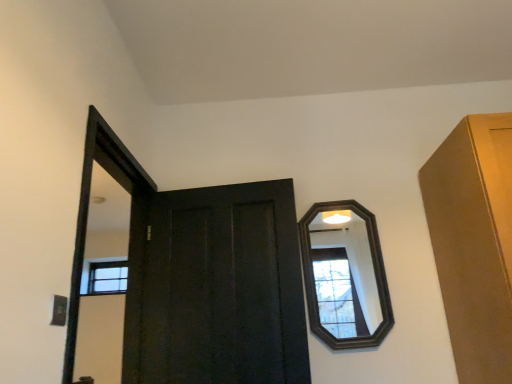
Question: Looking at the image, does dark wood mirror at upper right seem bigger or smaller compared to matte black door at center?

Choices:
 (A) big
 (B) small

Answer: (B)

Question: Looking at their shapes, would you say dark wood mirror at upper right is wider or thinner than matte black door at center?

Choices:
 (A) wide
 (B) thin

Answer: (B)

Question: Is dark wood mirror at upper right in front of or behind matte black door at center in the image?

Choices:
 (A) front
 (B) behind

Answer: (B)

Question: Which is correct: matte black door at center is inside dark wood mirror at upper right, or outside of it?

Choices:
 (A) inside
 (B) outside

Answer: (B)

Question: From the image's perspective, is matte black door at center located above or below dark wood mirror at upper right?

Choices:
 (A) below
 (B) above

Answer: (A)

Question: Is matte black door at center in front of or behind dark wood mirror at upper right in the image?

Choices:
 (A) behind
 (B) front

Answer: (B)

Question: From a real-world perspective, is matte black door at center physically located above or below dark wood mirror at upper right?

Choices:
 (A) above
 (B) below

Answer: (B)